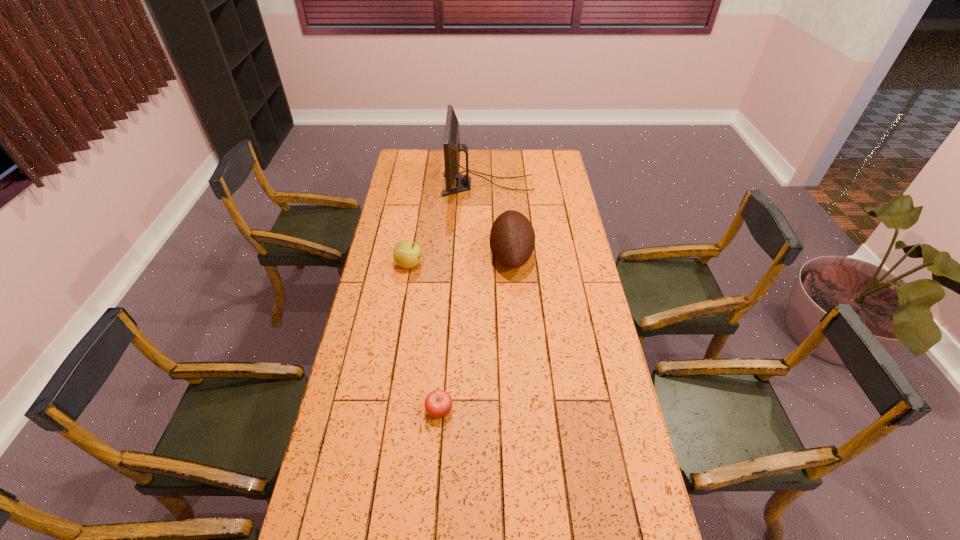
Identify the location of vacant space located 0.060m on the laces of the second tallest object. The width and height of the screenshot is (960, 540). (475, 255).

At what (x,y) coordinates should I click in order to perform the action: click on free spot located on the laces of the second tallest object. Please return your answer as a coordinate pair (x, y). The width and height of the screenshot is (960, 540). Looking at the image, I should click on (442, 255).

Find the location of `free location located on the laces of the second tallest object`. free location located on the laces of the second tallest object is located at coordinates (396, 255).

This screenshot has width=960, height=540. I want to click on free space located on the logo side of the leftmost object, so click(x=486, y=264).

Identify the location of vacant area situated on the right of the apple. (492, 410).

Locate an element on the screen. This screenshot has width=960, height=540. object that is at the far edge is located at coordinates (452, 147).

Locate an element on the screen. object that is at the left edge is located at coordinates (407, 254).

The width and height of the screenshot is (960, 540). What are the coordinates of `vacant space at the far edge of the desktop` in the screenshot? It's located at (481, 163).

Where is `blank space at the left edge of the desktop`? blank space at the left edge of the desktop is located at coordinates (420, 215).

I want to click on vacant space at the right edge of the desktop, so click(551, 208).